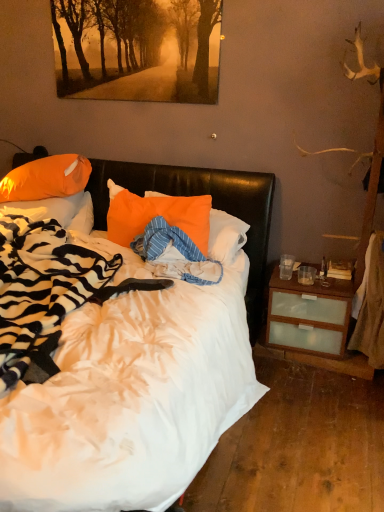
Question: Considering the positions of orange fabric pillow at center, the first pillow when ordered from right to left, and white soft bed at center in the image, is orange fabric pillow at center, the first pillow when ordered from right to left, bigger or smaller than white soft bed at center?

Choices:
 (A) big
 (B) small

Answer: (B)

Question: Looking at their shapes, would you say orange fabric pillow at center, the first pillow when ordered from right to left, is wider or thinner than white soft bed at center?

Choices:
 (A) thin
 (B) wide

Answer: (A)

Question: Considering the real-world distances, which object is farthest from the orange fabric pillow at left, which is the 1th pillow from left to right?

Choices:
 (A) white soft bed at center
 (B) golden textured pathway at upper center
 (C) orange glossy pillow at upper left, which is the second pillow in left-to-right order
 (D) orange fabric pillow at center, the 3th pillow viewed from the left

Answer: (A)

Question: Estimate the real-world distances between objects in this image. Which object is closer to the orange fabric pillow at center, the 3th pillow viewed from the left?

Choices:
 (A) white soft bed at center
 (B) orange fabric pillow at left, which is the 1th pillow from left to right
 (C) golden textured pathway at upper center
 (D) orange glossy pillow at upper left, which is the second pillow in left-to-right order

Answer: (B)